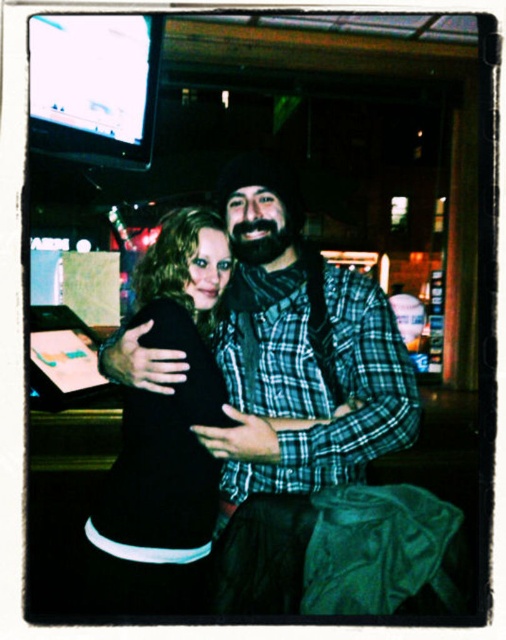
From the picture: You are a photographer trying to capture a clear shot of both the plaid flannel shirt at center and the black matte dress at center. Since the camera can only focus on one subject at a time, which one should you focus on to ensure the other is still somewhat visible in the background?

You should focus on the plaid flannel shirt at center because it is in front of the black matte dress at center, so the dress will be visible in the background if the shirt is in focus.

You are a photographer trying to capture a candid shot of the plaid flannel shirt at center and the black matte dress at center. Your camera has a depth of field that can focus on objects within 6 inches of each other. Can you get both subjects in focus without adjusting your settings?

The distance between the plaid flannel shirt at center and the black matte dress at center is 7.09 inches, which exceeds the 6 inch focus range. Therefore, you cannot capture both in focus without adjusting your camera settings.

You are at a bar and want to know which clothing item is on the right side between the plaid flannel shirt at center and the black matte dress at center. Can you tell me?

The plaid flannel shirt at center is to the right of the black matte dress at center.